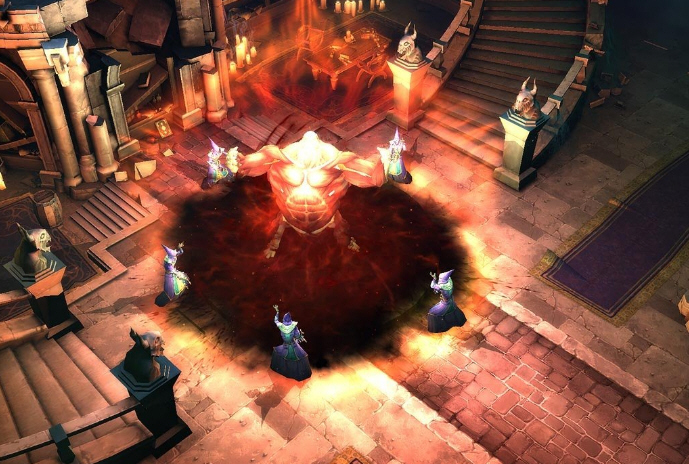
The image size is (689, 464). I want to click on pillar, so click(60, 118), click(81, 111), click(105, 138), click(214, 88).